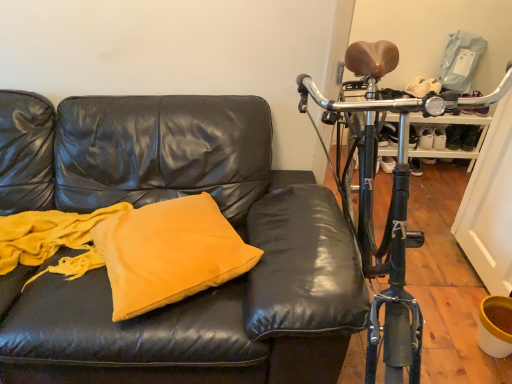
Question: Is shiny black bicycle at right bigger or smaller than matte yellow pillow at center?

Choices:
 (A) small
 (B) big

Answer: (B)

Question: From the image's perspective, is shiny black bicycle at right located above or below matte yellow pillow at center?

Choices:
 (A) below
 (B) above

Answer: (B)

Question: From a real-world perspective, relative to matte yellow pillow at center, is shiny black bicycle at right vertically above or below?

Choices:
 (A) above
 (B) below

Answer: (A)

Question: From a real-world perspective, is matte yellow pillow at center positioned above or below shiny black bicycle at right?

Choices:
 (A) above
 (B) below

Answer: (B)

Question: Is matte yellow pillow at center in front of or behind shiny black bicycle at right in the image?

Choices:
 (A) behind
 (B) front

Answer: (A)

Question: Which is correct: matte yellow pillow at center is inside shiny black bicycle at right, or outside of it?

Choices:
 (A) inside
 (B) outside

Answer: (B)

Question: Looking at their shapes, would you say matte yellow pillow at center is wider or thinner than shiny black bicycle at right?

Choices:
 (A) thin
 (B) wide

Answer: (A)